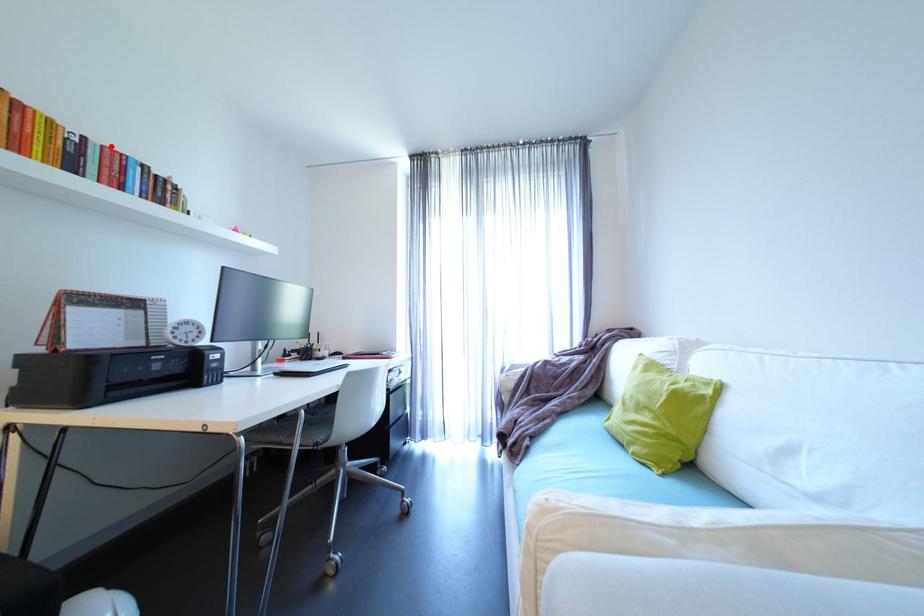
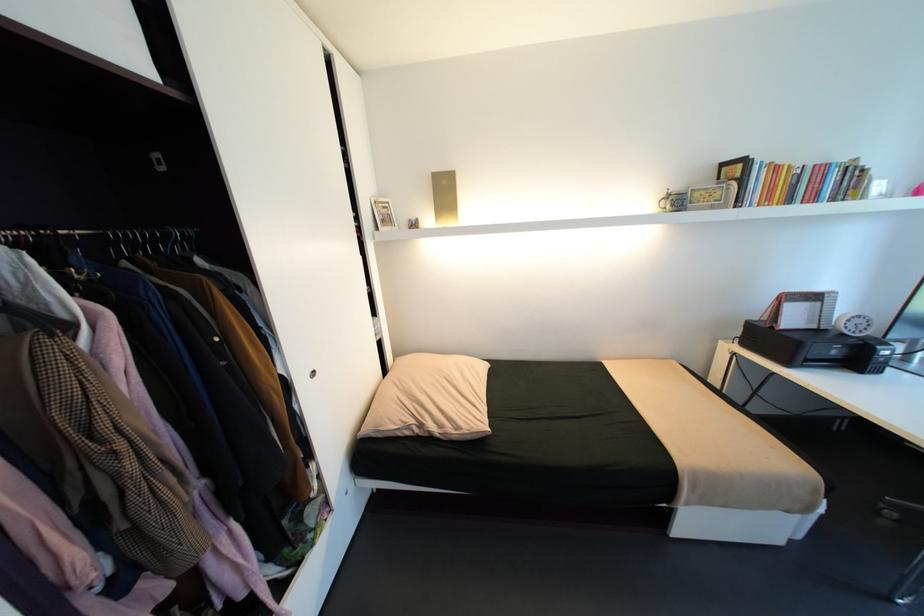
In the second image, find the point that corresponds to the highlighted location in the first image.

(821, 166)